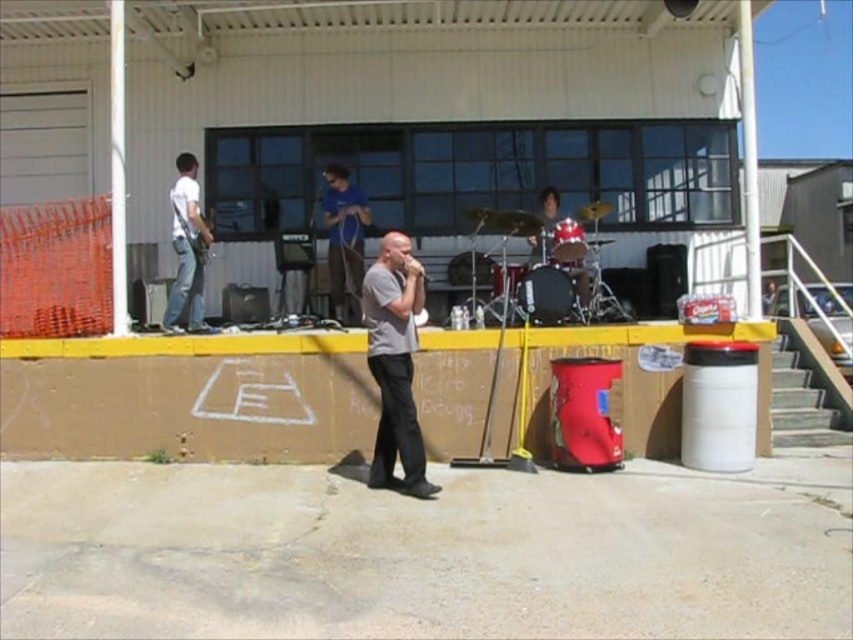
You are a photographer setting up for the band performance. You need to decide where to place your camera to capture both the white matte guitar at left and the blue cotton shirt at center without zooming in. Considering their sizes, which object should you focus on to ensure both fit in the frame?

The white matte guitar at left is wider than the blue cotton shirt at center, so focusing on the guitar will help ensure both objects fit in the frame since it requires more space.

You are a photographer trying to capture a clear shot of both the gray matte shirt at center and the blue cotton shirt at center during the band performance. Which shirt should you focus on first to ensure both are in frame?

The gray matte shirt at center is positioned under the blue cotton shirt at center, so you should focus on the blue cotton shirt at center first to ensure it stays in frame while adjusting for the lower gray matte shirt at center.

You are a photographer at the back of the crowd, trying to capture both the gray matte shirt at center and the blue cotton shirt at center in a single shot. Which shirt should you focus on first to ensure both are in frame?

You should focus on the gray matte shirt at center first because it is larger in size than the blue cotton shirt at center, so it will be more visible and easier to frame.